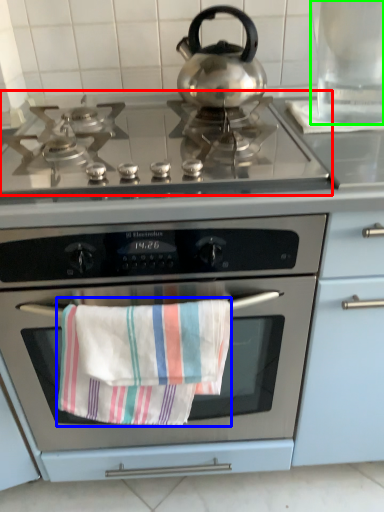
Question: Based on their relative distances, which object is nearer to gas stove (highlighted by a red box)? Choose from beach towel (highlighted by a blue box) and appliance (highlighted by a green box).

Choices:
 (A) beach towel
 (B) appliance

Answer: (B)